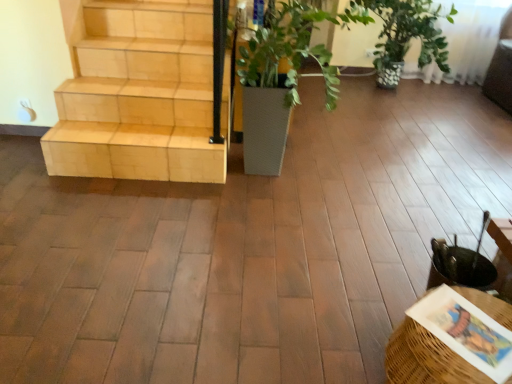
Describe the element at coordinates (425, 359) in the screenshot. Image resolution: width=512 pixels, height=384 pixels. I see `woven wood table at lower right` at that location.

Where is `woven wood table at lower right`? woven wood table at lower right is located at coordinates (425, 359).

Measure the distance between point (473, 294) and camera.

4.59 feet.

At what (x,y) coordinates should I click in order to perform the action: click on woven wood table at lower right. Please return your answer as a coordinate pair (x, y). The image size is (512, 384). Looking at the image, I should click on (425, 359).